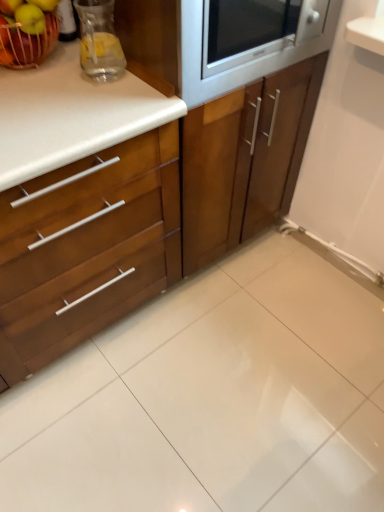
Image resolution: width=384 pixels, height=512 pixels. I want to click on spots to the right of clear glass pitcher at upper left, so click(145, 77).